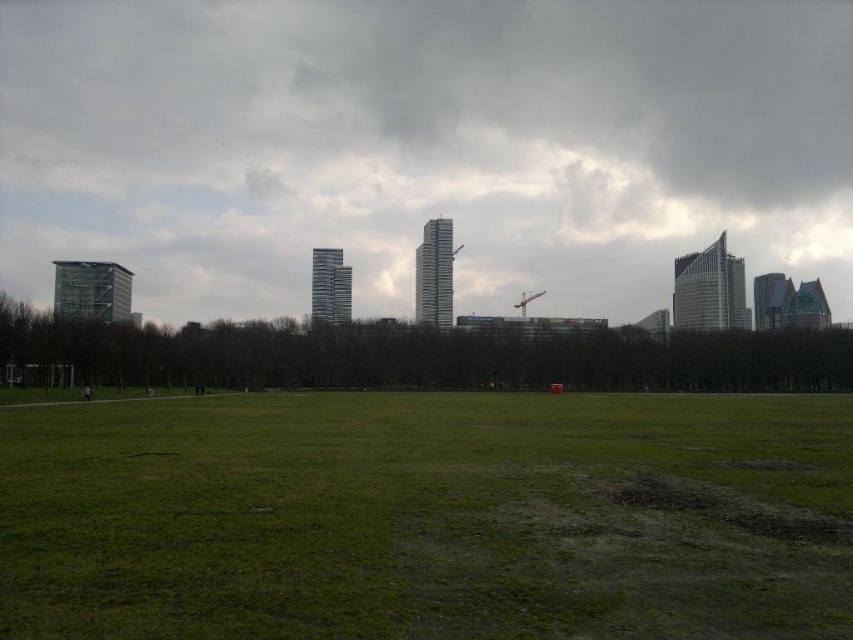
Question: From the image, what is the correct spatial relationship of white fluffy cloud at upper center in relation to green grass at center?

Choices:
 (A) right
 (B) left

Answer: (A)

Question: Which of the following is the farthest from the observer?

Choices:
 (A) (297, 412)
 (B) (294, 250)

Answer: (B)

Question: From the image, what is the correct spatial relationship of white fluffy cloud at upper center in relation to green grass at center?

Choices:
 (A) left
 (B) right

Answer: (B)

Question: Is white fluffy cloud at upper center wider than green grass at center?

Choices:
 (A) no
 (B) yes

Answer: (B)